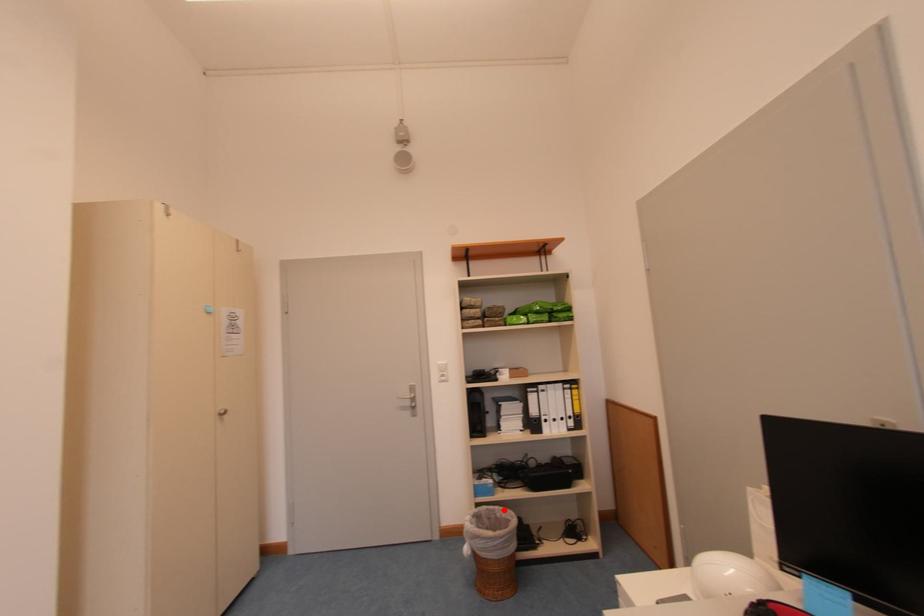
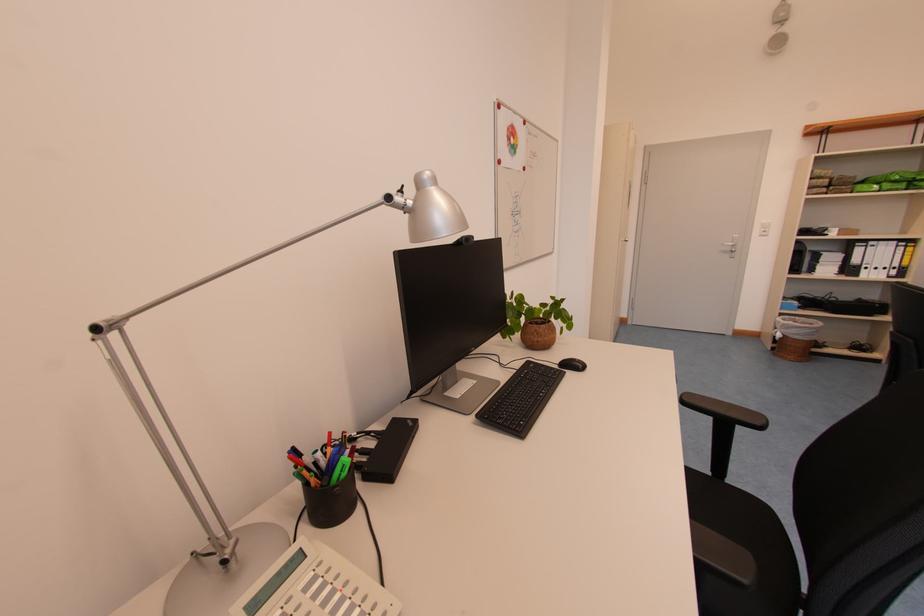
In the second image, find the point that corresponds to the highlighted location in the first image.

(805, 321)